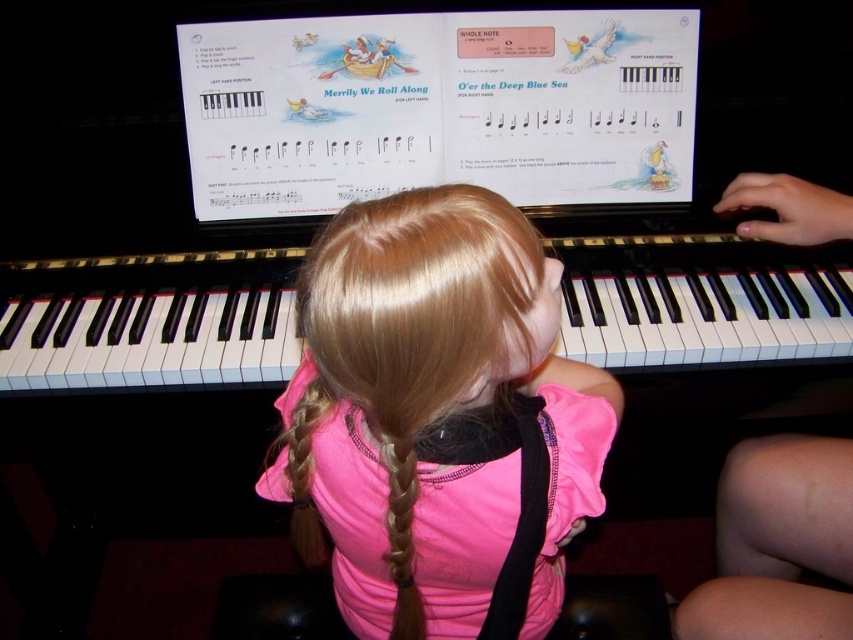
You are a photographer standing in front of the girl playing the piano. You want to take a closeup shot of her face while ensuring the pink fabric shirt at center is still visible in the frame. Given your current distance, is it possible to capture both in the shot?

The pink fabric shirt at center is 18.79 inches away from the viewer. Since the shirt is relatively close and within the same plane as the girl, it should be possible to capture both her face and the shirt in the same frame by adjusting the camera angle or zoom level appropriately.

You are standing at the point with coordinates point (422, 624) and want to move to the point with coordinates point (49, 340). Is there a clear path between these two points without any obstacles?

Point (49, 340) is behind point (422, 624), so there might be an obstacle blocking the path between them. You may need to move around the point (422, 624) to reach the point (49, 340).